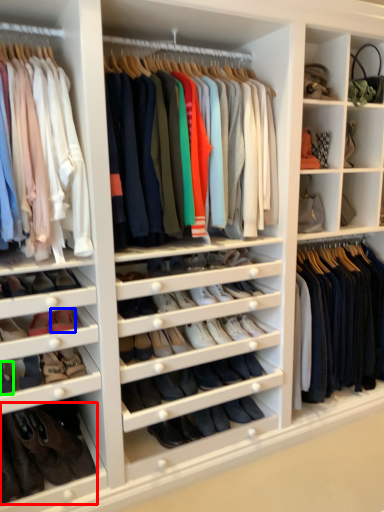
Question: Which is farther away from footwear (highlighted by a red box)? shoe (highlighted by a blue box) or shoe (highlighted by a green box)?

Choices:
 (A) shoe
 (B) shoe

Answer: (A)